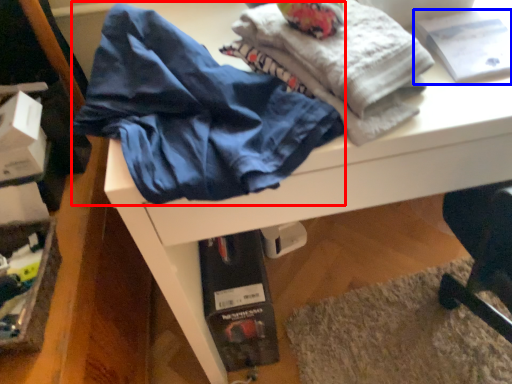
Question: Which point is further to the camera, clothing (highlighted by a red box) or book (highlighted by a blue box)?

Choices:
 (A) clothing
 (B) book

Answer: (B)